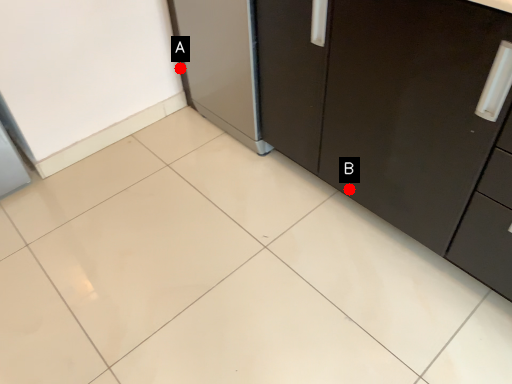
Question: Two points are circled on the image, labeled by A and B beside each circle. Which point appears closest to the camera in this image?

Choices:
 (A) A is closer
 (B) B is closer

Answer: (B)